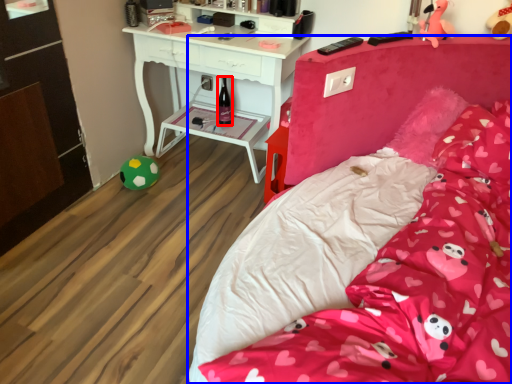
Question: Which of the following is the closest to the observer, bottle (highlighted by a red box) or bed (highlighted by a blue box)?

Choices:
 (A) bottle
 (B) bed

Answer: (B)